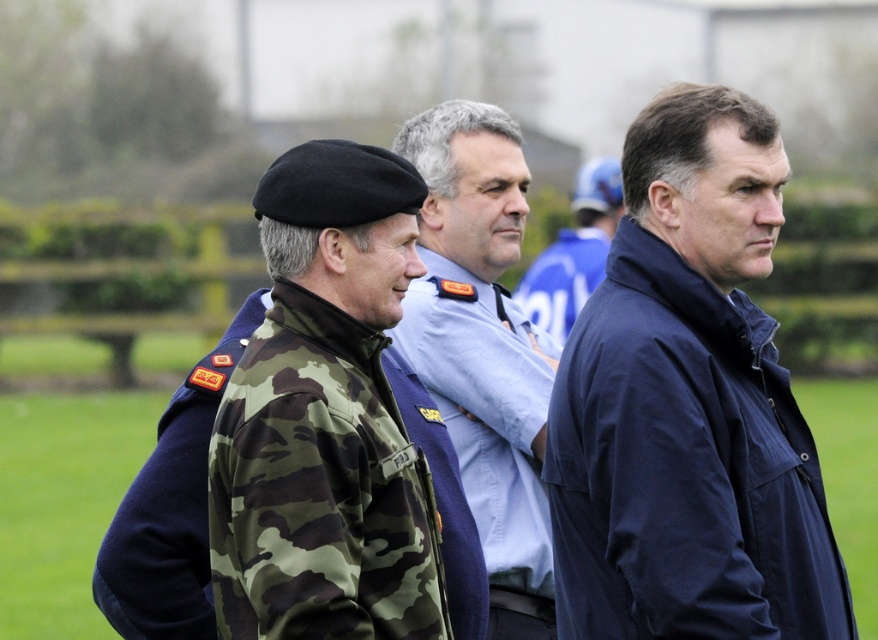
You are standing in the park and see two points marked in the image. Which point is closer to you, point (663,579) or point (476,464)?

Point (663,579) is closer to the viewer than point (476,464).

You are trying to decide which jacket to wear for a hike. You see two jackets in the image, the camouflage fabric jacket at center and the camo fabric jacket at center. Which one is wider?

The camouflage fabric jacket at center is wider than the camo fabric jacket at center according to the description.